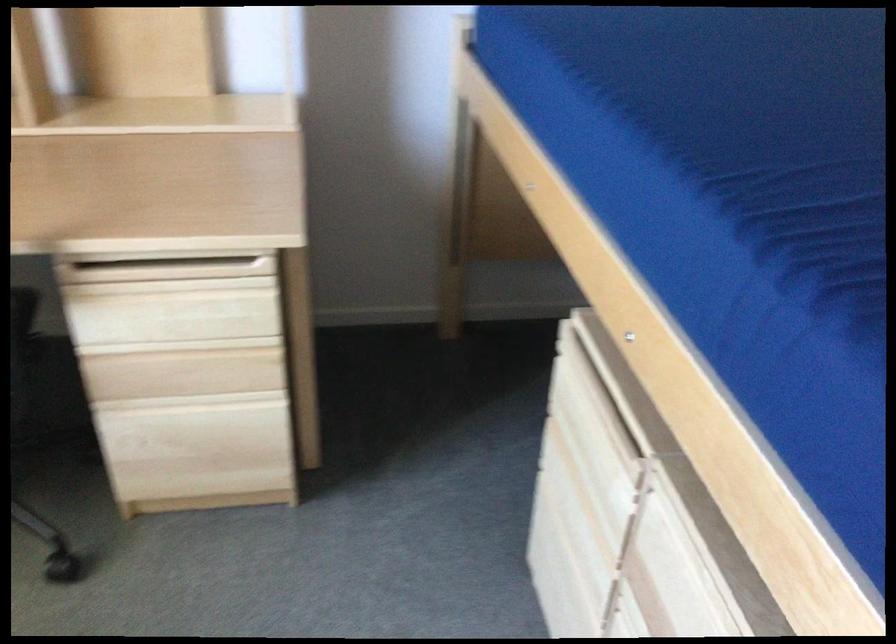
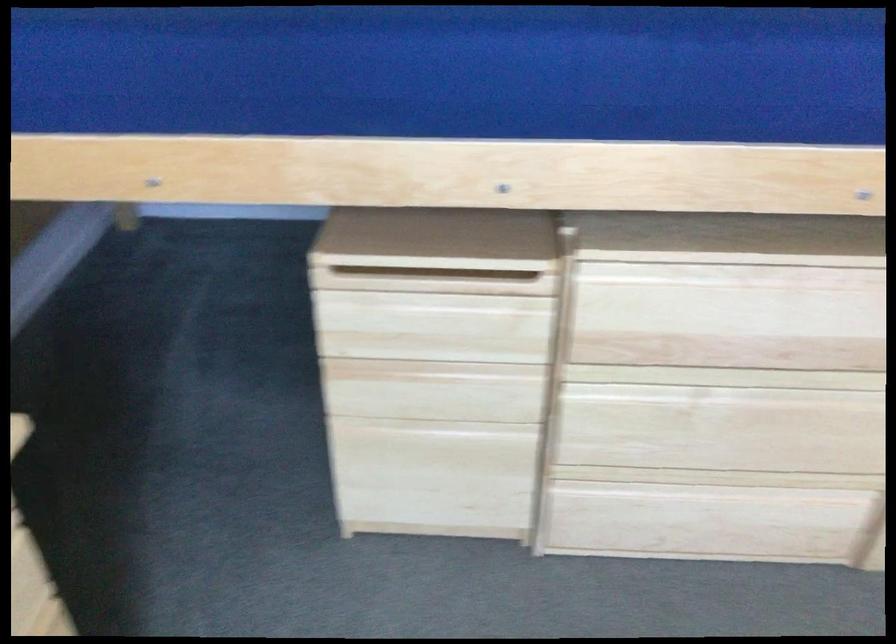
Where in the second image is the point corresponding to pixel 572 473 from the first image?

(426, 371)